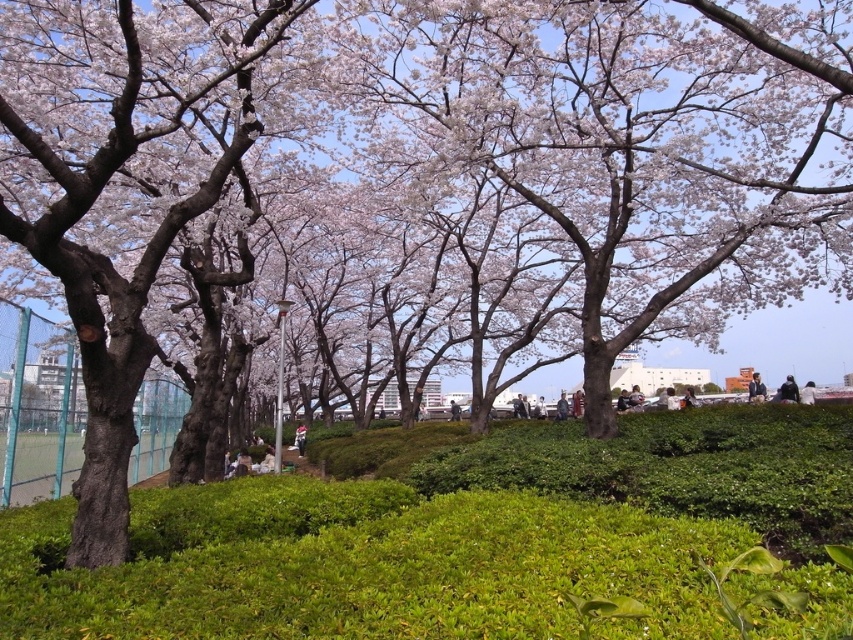
Between dark gray fabric jacket at upper right and dark blue jacket at center, which one is positioned lower?

dark blue jacket at center is below.

Between dark gray fabric jacket at upper right and dark blue jacket at center, which one appears on the left side from the viewer's perspective?

dark blue jacket at center

What do you see at coordinates (788, 390) in the screenshot? The height and width of the screenshot is (640, 853). I see `dark gray fabric jacket at upper right` at bounding box center [788, 390].

Image resolution: width=853 pixels, height=640 pixels. Identify the location of dark gray fabric jacket at upper right. (788, 390).

Is green leafy shrubs at center smaller than dark gray fabric jacket at upper right?

Yes, green leafy shrubs at center is smaller than dark gray fabric jacket at upper right.

Can you confirm if green leafy shrubs at center is thinner than dark gray fabric jacket at upper right?

Yes.

At what (x,y) coordinates should I click in order to perform the action: click on green leafy shrubs at center. Please return your answer as a coordinate pair (x, y). The height and width of the screenshot is (640, 853). Looking at the image, I should click on (454, 536).

The height and width of the screenshot is (640, 853). What are the coordinates of `green leafy shrubs at center` in the screenshot? It's located at (454, 536).

Does dark gray fabric jacket at upper right have a greater width compared to white cotton shirt at center?

Indeed, dark gray fabric jacket at upper right has a greater width compared to white cotton shirt at center.

Between dark gray fabric jacket at upper right and white cotton shirt at center, which one appears on the left side from the viewer's perspective?

Positioned to the left is white cotton shirt at center.

Where is `dark gray fabric jacket at upper right`? The image size is (853, 640). dark gray fabric jacket at upper right is located at coordinates (788, 390).

Where is `dark gray fabric jacket at upper right`? dark gray fabric jacket at upper right is located at coordinates (788, 390).